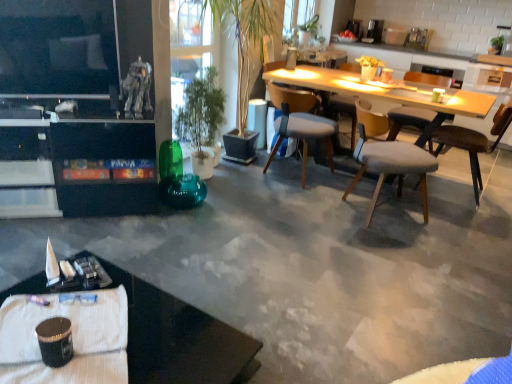
Identify the location of free location to the right of white textured tablecloth at lower left. (167, 333).